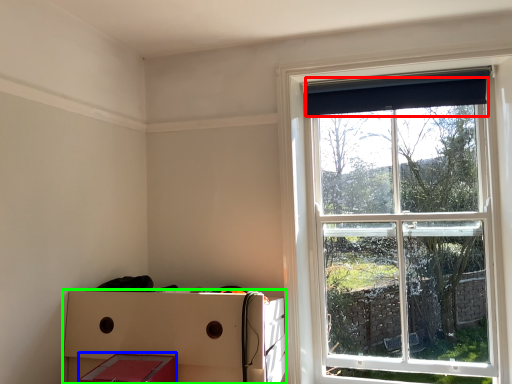
Question: Considering the real-world distances, which object is farthest from curtain (highlighted by a red box)? storage box (highlighted by a blue box) or crate (highlighted by a green box)?

Choices:
 (A) storage box
 (B) crate

Answer: (A)